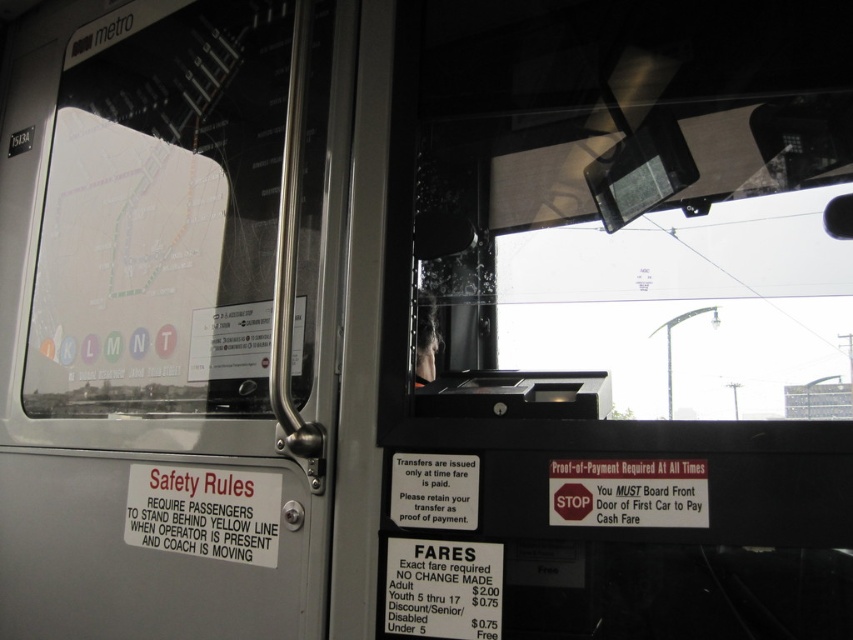
You are standing inside the public transit vehicle and want to know how far you are from the point marked at coordinates point [312,481]. Can you determine the distance?

The distance between you and point [312,481] is 3.92 feet.

You are a passenger on a bus and need to determine which object is taller between the gray metallic door at left and the transparent glass windshield at center. Based on the scene description, which one is taller?

The gray metallic door at left is taller than the transparent glass windshield at center according to the description.